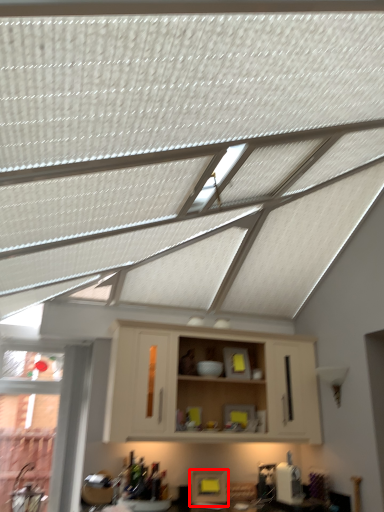
Question: In this image, where is appliance (annotated by the red box) located relative to cabinetry?

Choices:
 (A) left
 (B) right

Answer: (A)